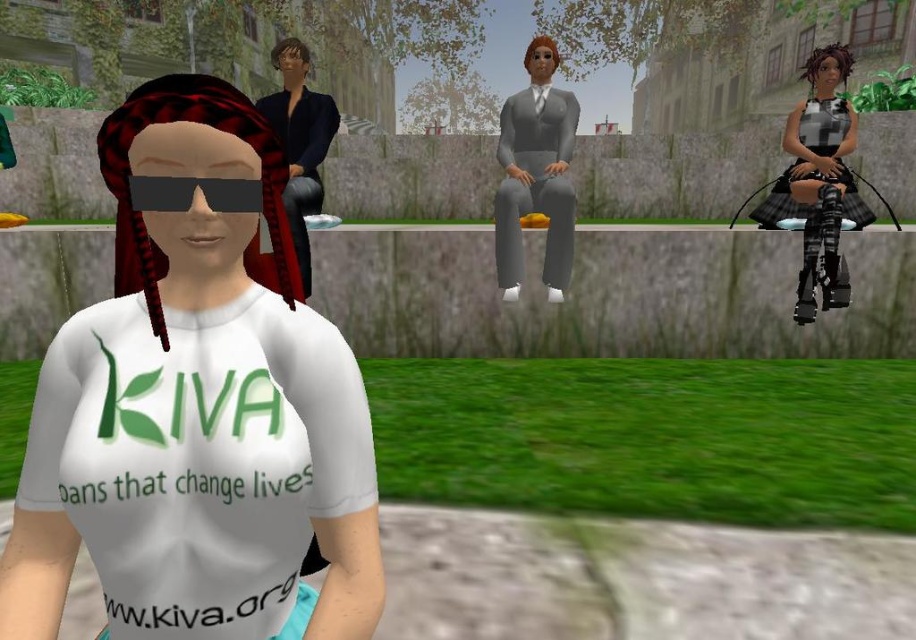
Can you confirm if matte gray suit at center is taller than matte black jacket at upper left?

Yes.

Does matte gray suit at center come behind matte black jacket at upper left?

Yes, matte gray suit at center is further from the viewer.

This screenshot has width=916, height=640. Identify the location of matte gray suit at center. (536, 172).

Between checkered fabric dress at right and matte gray suit at center, which one appears on the right side from the viewer's perspective?

checkered fabric dress at right is more to the right.

Who is more distant from viewer, (802,252) or (541,100)?

Point (802,252)

Identify the location of checkered fabric dress at right. This screenshot has width=916, height=640. (818, 180).

Locate an element on the screen. This screenshot has width=916, height=640. checkered fabric dress at right is located at coordinates (818, 180).

Does white matte t-shirt at center have a smaller size compared to matte black jacket at upper left?

Correct, white matte t-shirt at center occupies less space than matte black jacket at upper left.

Is white matte t-shirt at center further to camera compared to matte black jacket at upper left?

No.

The image size is (916, 640). Describe the element at coordinates (197, 406) in the screenshot. I see `white matte t-shirt at center` at that location.

I want to click on white matte t-shirt at center, so click(x=197, y=406).